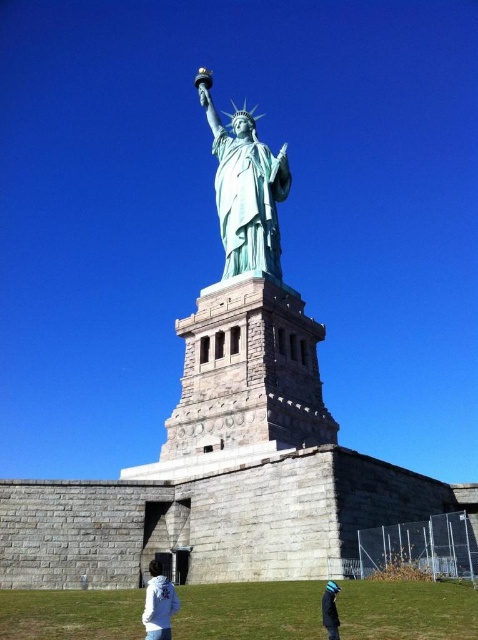
Is white fleece jacket at lower center positioned before blue knit cap at lower center?

No.

How distant is white fleece jacket at lower center from blue knit cap at lower center?

A distance of 6.53 meters exists between white fleece jacket at lower center and blue knit cap at lower center.

This screenshot has width=478, height=640. I want to click on white fleece jacket at lower center, so click(159, 604).

Is green patina statue at center wider than blue knit cap at lower center?

Yes.

Between green patina statue at center and blue knit cap at lower center, which one appears on the left side from the viewer's perspective?

From the viewer's perspective, green patina statue at center appears more on the left side.

Is point (235, 232) positioned in front of point (325, 627)?

That is False.

Locate an element on the screen. green patina statue at center is located at coordinates (246, 188).

Does green patina statue at center lie behind white fleece jacket at lower center?

Yes, green patina statue at center is behind white fleece jacket at lower center.

Can you confirm if green patina statue at center is shorter than white fleece jacket at lower center?

No, green patina statue at center is not shorter than white fleece jacket at lower center.

Which is in front, point (221, 211) or point (165, 618)?

Point (165, 618) is more forward.

Identify the location of green patina statue at center. (246, 188).